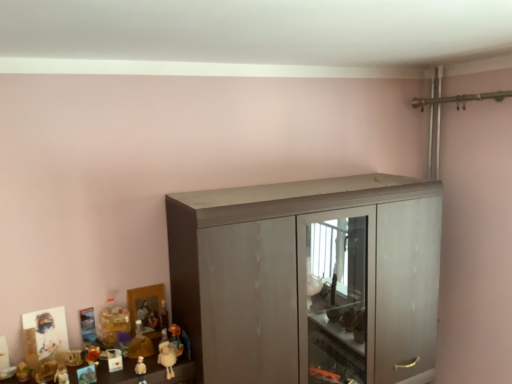
Question: Is matte plastic toy at lower left, which ranks as the 5th toy in right-to-left order, next to matte gray cupboard at center and touching it?

Choices:
 (A) no
 (B) yes

Answer: (A)

Question: From the image's perspective, is matte plastic toy at lower left, which ranks as the 5th toy in right-to-left order, on top of matte gray cupboard at center?

Choices:
 (A) yes
 (B) no

Answer: (B)

Question: From the image's perspective, would you say matte plastic toy at lower left, acting as the 4th toy starting from the left, is shown under matte gray cupboard at center?

Choices:
 (A) no
 (B) yes

Answer: (B)

Question: Is matte plastic toy at lower left, which ranks as the 5th toy in right-to-left order, closer to the viewer compared to matte gray cupboard at center?

Choices:
 (A) no
 (B) yes

Answer: (A)

Question: From a real-world perspective, is matte plastic toy at lower left, acting as the 4th toy starting from the left, on top of matte gray cupboard at center?

Choices:
 (A) no
 (B) yes

Answer: (A)

Question: Considering the positions of white plush sheep at lower left, positioned as the first toy in right-to-left order, and matte plastic figurine at lower left, which ranks as the second toy in right-to-left order, in the image, is white plush sheep at lower left, positioned as the first toy in right-to-left order, taller or shorter than matte plastic figurine at lower left, which ranks as the second toy in right-to-left order,?

Choices:
 (A) tall
 (B) short

Answer: (A)

Question: Which is correct: white plush sheep at lower left, positioned as the first toy in right-to-left order, is inside matte plastic figurine at lower left, the seventh toy viewed from the left, or outside of it?

Choices:
 (A) outside
 (B) inside

Answer: (A)

Question: Is point (174, 355) closer or farther from the camera than point (136, 372)?

Choices:
 (A) closer
 (B) farther

Answer: (B)

Question: In terms of width, does white plush sheep at lower left, positioned as the first toy in right-to-left order, look wider or thinner when compared to matte plastic figurine at lower left, which ranks as the second toy in right-to-left order?

Choices:
 (A) thin
 (B) wide

Answer: (B)

Question: Does point (206, 334) appear closer or farther from the camera than point (93, 380)?

Choices:
 (A) closer
 (B) farther

Answer: (B)

Question: In the image, is matte gray cupboard at center positioned in front of or behind matte plastic toy at lower left, acting as the 4th toy starting from the left?

Choices:
 (A) front
 (B) behind

Answer: (A)

Question: From the image's perspective, relative to matte plastic toy at lower left, which ranks as the 5th toy in right-to-left order, is matte gray cupboard at center above or below?

Choices:
 (A) above
 (B) below

Answer: (A)

Question: From a real-world perspective, is matte gray cupboard at center above or below matte plastic toy at lower left, which ranks as the 5th toy in right-to-left order?

Choices:
 (A) above
 (B) below

Answer: (A)

Question: Does point (350, 307) appear closer or farther from the camera than point (97, 352)?

Choices:
 (A) farther
 (B) closer

Answer: (A)

Question: Is matte gray cupboard at center situated inside shiny orange toy at lower left, the sixth toy viewed from the right, or outside?

Choices:
 (A) outside
 (B) inside

Answer: (A)